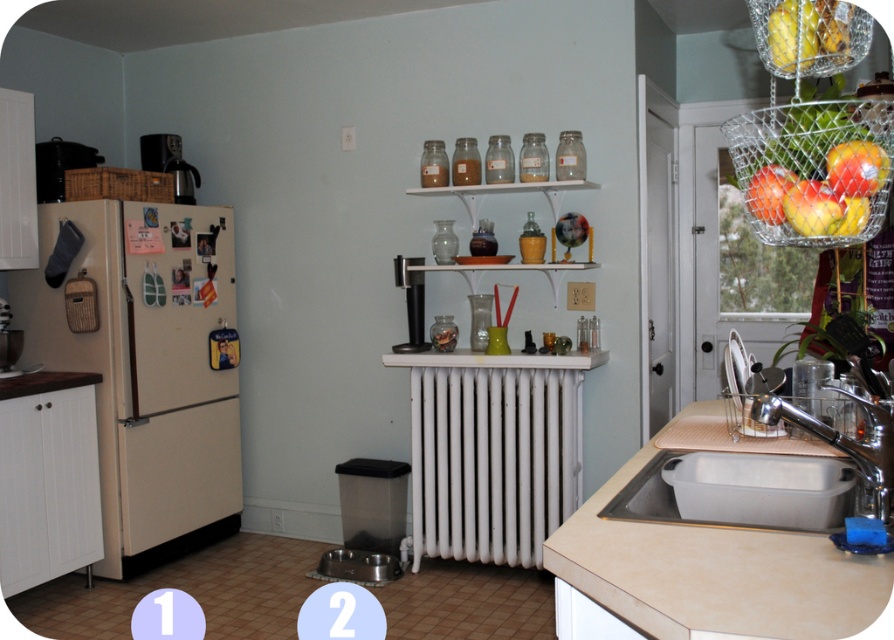
Is beige matte refrigerator at left closer to the viewer compared to wooden countertop at lower left?

No, beige matte refrigerator at left is behind wooden countertop at lower left.

Can you confirm if beige matte refrigerator at left is thinner than wooden countertop at lower left?

In fact, beige matte refrigerator at left might be wider than wooden countertop at lower left.

Which is in front, point (175, 500) or point (13, 376)?

Point (13, 376)

Identify the location of beige matte refrigerator at left. (148, 368).

Is stainless steel sink at lower right shorter than wooden countertop at lower left?

No.

Between point (786, 465) and point (49, 388), which one is positioned in front?

Point (786, 465) is more forward.

Where is `stainless steel sink at lower right`? stainless steel sink at lower right is located at coordinates (736, 493).

Does red matte apple at upper right have a greater height compared to wooden countertop at lower left?

Correct, red matte apple at upper right is much taller as wooden countertop at lower left.

Which is in front, point (777, 211) or point (60, 381)?

Point (777, 211) is in front.

I want to click on red matte apple at upper right, so click(x=769, y=193).